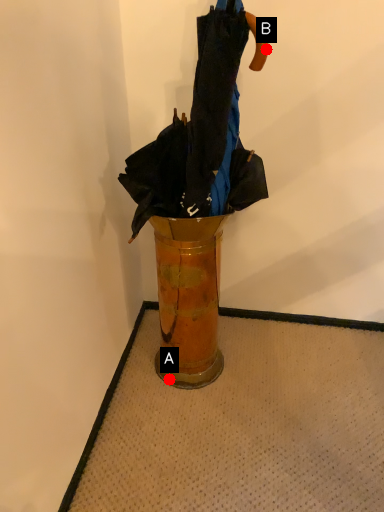
Question: Two points are circled on the image, labeled by A and B beside each circle. Among these points, which one is farthest from the camera?

Choices:
 (A) A is further
 (B) B is further

Answer: (A)